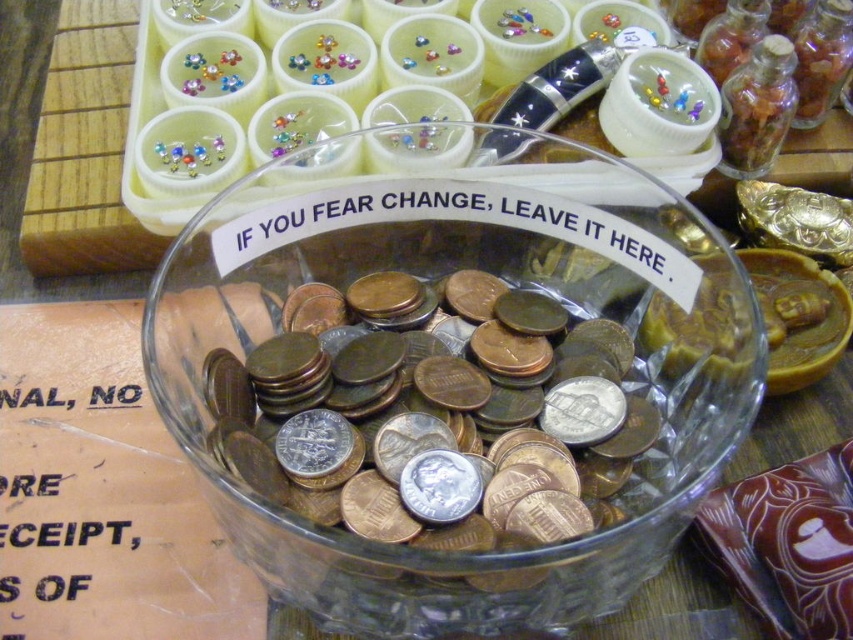
Can you confirm if clear glass bowl at center is positioned below silver metallic coins at center?

Actually, clear glass bowl at center is above silver metallic coins at center.

Which is in front, point (294, 394) or point (219, 355)?

Point (219, 355)

Find the location of a particular element. clear glass bowl at center is located at coordinates (456, 369).

The image size is (853, 640). I want to click on clear glass bowl at center, so point(456,369).